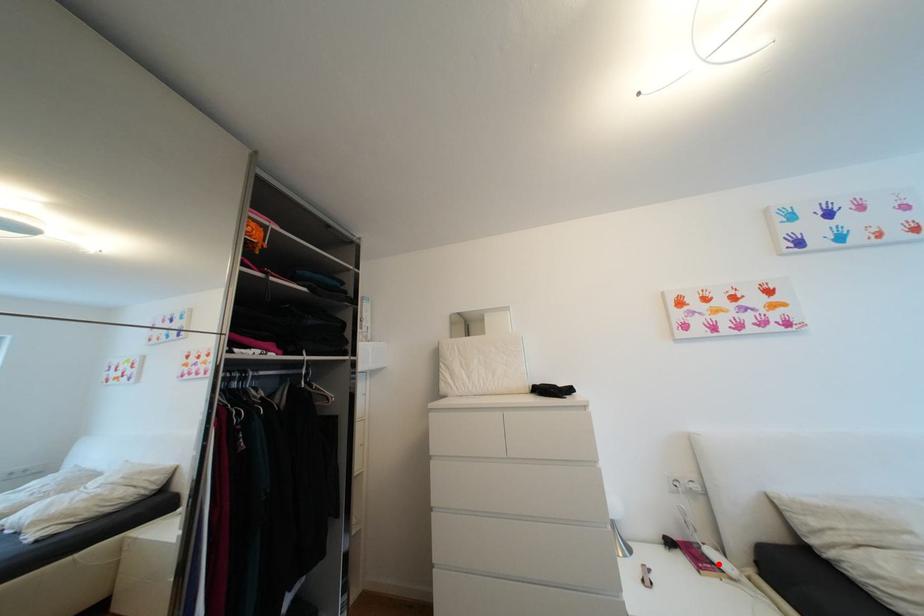
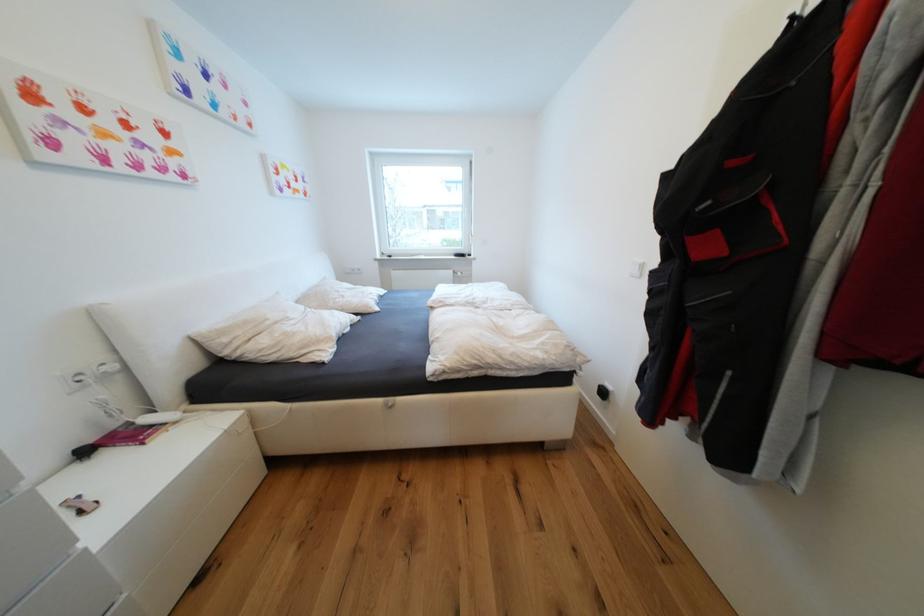
Question: I am providing you with two images of the same scene from different viewpoints. Given a red point in image1, look at the same physical point in image2. Is it:

Choices:
 (A) Closer to the viewpoint
 (B) Farther from the viewpoint

Answer: (B)